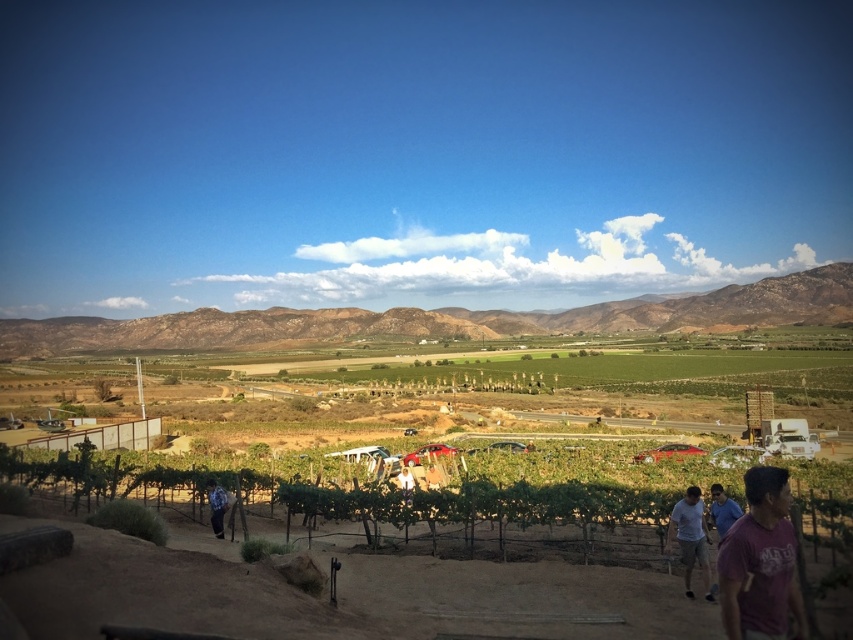
Question: Does purple cotton shirt at lower right have a larger size compared to white fabric at center?

Choices:
 (A) yes
 (B) no

Answer: (A)

Question: Which of the following is the farthest from the observer?

Choices:
 (A) coord(115,324)
 (B) coord(398,472)
 (C) coord(758,584)

Answer: (A)

Question: Which object is farther from the camera taking this photo?

Choices:
 (A) blue denim jeans at lower left
 (B) white fabric at center
 (C) purple cotton shirt at lower right

Answer: (B)

Question: Where is green grassy hill at center located in relation to blue denim jeans at lower left in the image?

Choices:
 (A) below
 (B) above

Answer: (B)

Question: Can you confirm if purple cotton shirt at lower right is thinner than white fabric at center?

Choices:
 (A) no
 (B) yes

Answer: (A)

Question: Which point appears farthest from the camera in this image?

Choices:
 (A) (668, 323)
 (B) (753, 481)

Answer: (A)